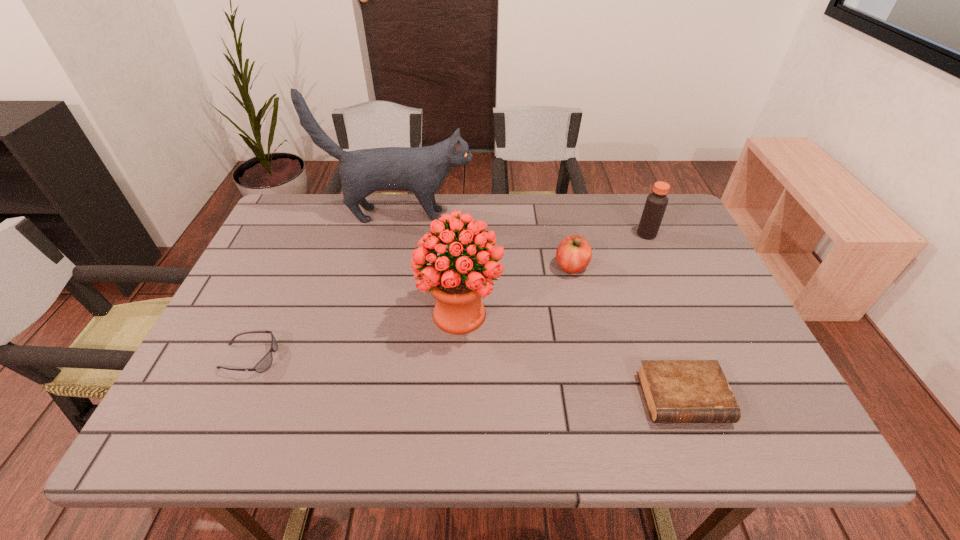
Find the location of a particular element. the fourth closest object to the fifth shortest object is located at coordinates (264, 364).

Image resolution: width=960 pixels, height=540 pixels. Identify the location of object that stands as the closest to the bouquet. (573, 255).

The image size is (960, 540). In order to click on free spot that satisfies the following two spatial constraints: 1. on the back side of the fourth nearest object; 2. on the left side of the bouquet in this screenshot , I will do pos(462,267).

Find the location of `blank space that satisfies the following two spatial constraints: 1. on the back side of the bouquet; 2. on the left side of the fourth shortest object`. blank space that satisfies the following two spatial constraints: 1. on the back side of the bouquet; 2. on the left side of the fourth shortest object is located at coordinates (464, 234).

In order to click on vacant space that satisfies the following two spatial constraints: 1. on the back side of the fifth nearest object; 2. on the left side of the fourth nearest object in this screenshot , I will do `click(564, 234)`.

Locate an element on the screen. vacant area in the image that satisfies the following two spatial constraints: 1. at the face of the tallest object; 2. on the right side of the fourth shortest object is located at coordinates (395, 234).